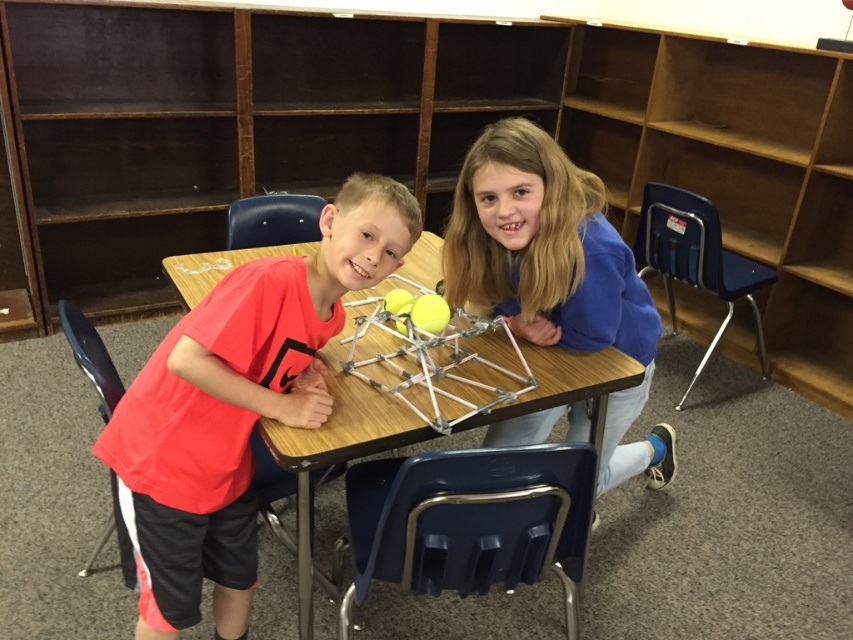
Question: Can you confirm if wooden bookshelf at upper center is positioned below blue fleece jacket at upper center?

Choices:
 (A) no
 (B) yes

Answer: (A)

Question: Can you confirm if wooden bookshelf at upper center is positioned below red matte shirt at center?

Choices:
 (A) yes
 (B) no

Answer: (B)

Question: Can you confirm if wooden bookshelf at upper center is smaller than red matte shirt at center?

Choices:
 (A) no
 (B) yes

Answer: (A)

Question: Which is farther from the red matte shirt at center?

Choices:
 (A) wooden bookshelf at upper center
 (B) wooden table at center

Answer: (A)

Question: Which object is positioned closest to the red matte shirt at center?

Choices:
 (A) blue fleece jacket at upper center
 (B) wooden table at center
 (C) wooden bookshelf at upper center

Answer: (B)

Question: Which point is closer to the camera taking this photo?

Choices:
 (A) [x=335, y=436]
 (B) [x=611, y=250]

Answer: (A)